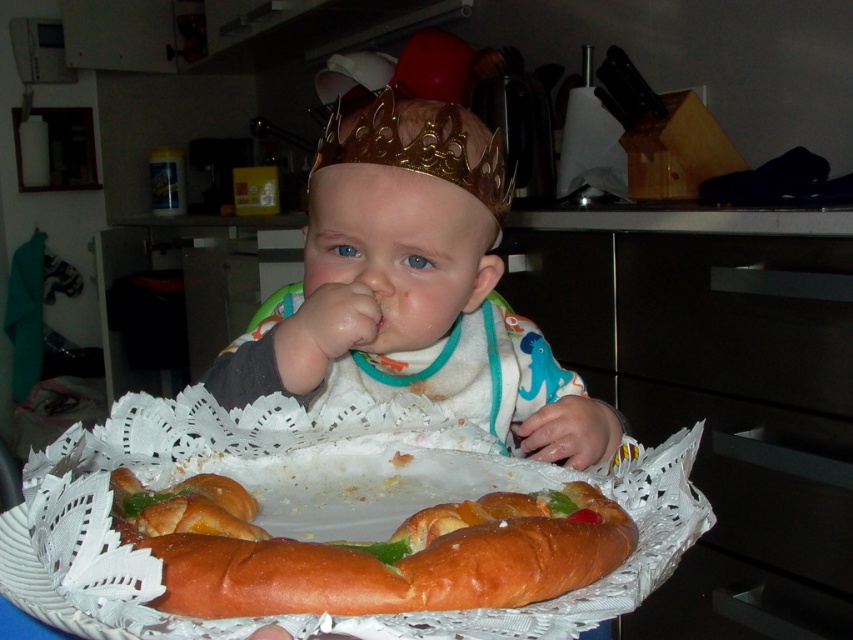
Based on the photo, which is more to the left, gold metallic crown at center or pink smooth flesh at center?

pink smooth flesh at center

Does point (383, 88) come closer to viewer compared to point (383, 330)?

No, (383, 88) is behind (383, 330).

Identify the location of gold metallic crown at center. (419, 150).

Can you confirm if gold crown at center is wider than pink smooth flesh at center?

Indeed, gold crown at center has a greater width compared to pink smooth flesh at center.

In the scene shown: Can you confirm if gold crown at center is shorter than pink smooth flesh at center?

Incorrect, gold crown at center's height does not fall short of pink smooth flesh at center's.

Measure the distance between point [390,97] and camera.

Point [390,97] is 25.60 inches from camera.

At what (x,y) coordinates should I click in order to perform the action: click on gold crown at center. Please return your answer as a coordinate pair (x, y). The image size is (853, 640). Looking at the image, I should click on [404, 220].

The height and width of the screenshot is (640, 853). I want to click on golden bread ring at center, so click(x=370, y=552).

Between golden bread ring at center and gold crown at center, which one is positioned lower?

golden bread ring at center is lower down.

The image size is (853, 640). What are the coordinates of `golden bread ring at center` in the screenshot? It's located at (370, 552).